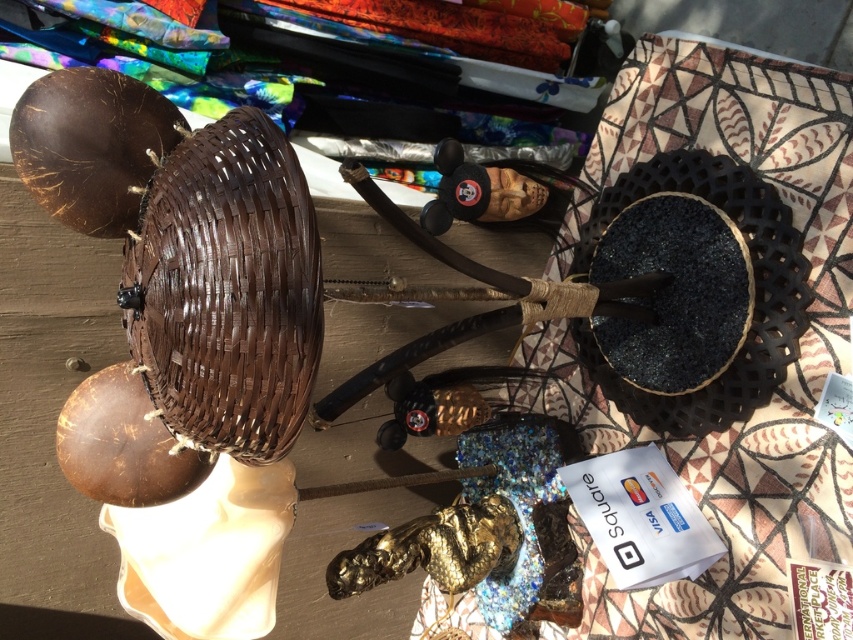
Question: Does brown woven basket at upper left have a smaller size compared to black woven basket at upper right?

Choices:
 (A) no
 (B) yes

Answer: (B)

Question: Does brown woven basket at upper left come behind black woven basket at upper right?

Choices:
 (A) yes
 (B) no

Answer: (B)

Question: Among these objects, which one is farthest from the camera?

Choices:
 (A) brown woven basket at upper left
 (B) black woven basket at upper right

Answer: (B)

Question: Does brown woven basket at upper left have a larger size compared to black woven basket at upper right?

Choices:
 (A) yes
 (B) no

Answer: (B)

Question: Which point is farther from the camera taking this photo?

Choices:
 (A) (268, 209)
 (B) (643, 396)

Answer: (B)

Question: Which point is farther to the camera?

Choices:
 (A) black woven basket at upper right
 (B) brown woven basket at upper left

Answer: (A)